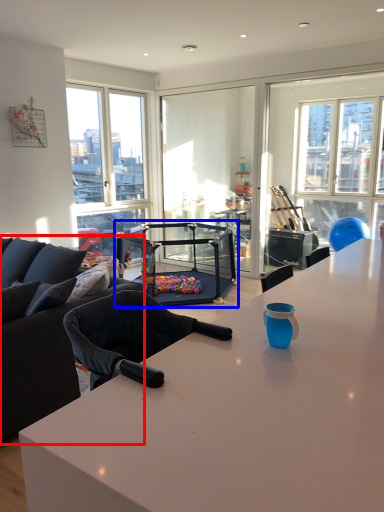
Question: Which point is closer to the camera, studio couch (highlighted by a red box) or equipment (highlighted by a blue box)?

Choices:
 (A) studio couch
 (B) equipment

Answer: (A)